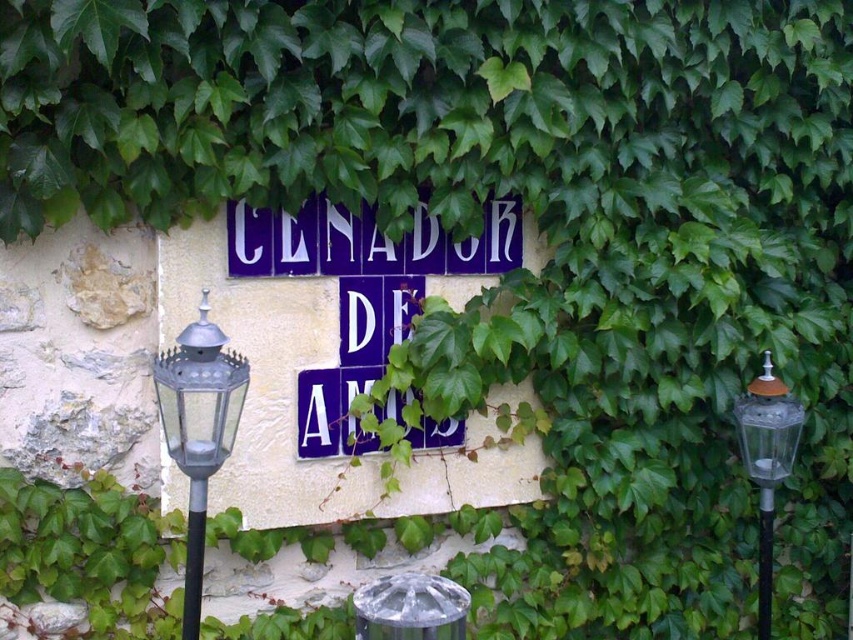
Looking at this image, is black matte pole at left taller than metallic glass pole at right?

In fact, black matte pole at left may be shorter than metallic glass pole at right.

Is black matte pole at left thinner than metallic glass pole at right?

Yes, black matte pole at left is thinner than metallic glass pole at right.

Which is in front, point (194, 636) or point (767, 602)?

Point (194, 636) is in front.

In order to click on black matte pole at left in this screenshot , I will do `click(194, 557)`.

Can you confirm if metallic glass at left is smaller than metallic glass pole at right?

Correct, metallic glass at left occupies less space than metallic glass pole at right.

Where is `metallic glass at left`? The width and height of the screenshot is (853, 640). metallic glass at left is located at coordinates (198, 428).

This screenshot has height=640, width=853. What do you see at coordinates (198, 428) in the screenshot? I see `metallic glass at left` at bounding box center [198, 428].

This screenshot has height=640, width=853. I want to click on metallic glass at left, so click(198, 428).

Is clear glass lamp post at right bigger than black matte pole at left?

Yes, clear glass lamp post at right is bigger than black matte pole at left.

Who is more distant from viewer, (769,532) or (190,531)?

The point (769,532) is behind.

Locate an element on the screen. clear glass lamp post at right is located at coordinates pos(767,461).